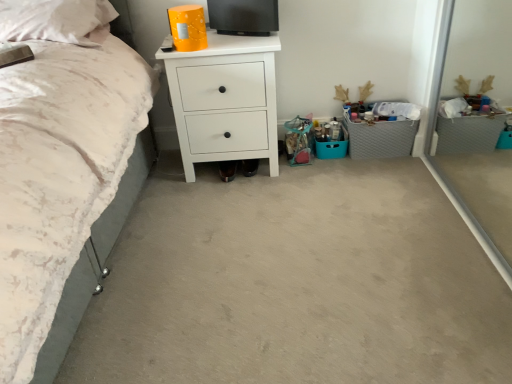
Question: Considering the relative sizes of white soft pillow at upper left and gray fabric storage at right in the image provided, is white soft pillow at upper left wider than gray fabric storage at right?

Choices:
 (A) yes
 (B) no

Answer: (A)

Question: Does white soft pillow at upper left have a greater height compared to gray fabric storage at right?

Choices:
 (A) no
 (B) yes

Answer: (A)

Question: From a real-world perspective, is white soft pillow at upper left under gray fabric storage at right?

Choices:
 (A) no
 (B) yes

Answer: (A)

Question: Considering the relative positions of white soft pillow at upper left and gray fabric storage at right in the image provided, is white soft pillow at upper left to the right of gray fabric storage at right from the viewer's perspective?

Choices:
 (A) no
 (B) yes

Answer: (A)

Question: Does white soft pillow at upper left have a lesser width compared to gray fabric storage at right?

Choices:
 (A) yes
 (B) no

Answer: (B)

Question: From the image's perspective, is white soft pillow at upper left above gray fabric storage at right?

Choices:
 (A) yes
 (B) no

Answer: (A)

Question: Is white soft pillow at upper left in front of white matte chest of drawers at center?

Choices:
 (A) yes
 (B) no

Answer: (A)

Question: Is white soft pillow at upper left behind white matte chest of drawers at center?

Choices:
 (A) yes
 (B) no

Answer: (B)

Question: Considering the relative positions of white soft pillow at upper left and white matte chest of drawers at center in the image provided, is white soft pillow at upper left to the left of white matte chest of drawers at center from the viewer's perspective?

Choices:
 (A) yes
 (B) no

Answer: (A)

Question: Considering the relative sizes of white soft pillow at upper left and white matte chest of drawers at center in the image provided, is white soft pillow at upper left shorter than white matte chest of drawers at center?

Choices:
 (A) yes
 (B) no

Answer: (A)

Question: Is white soft pillow at upper left oriented away from white matte chest of drawers at center?

Choices:
 (A) yes
 (B) no

Answer: (B)

Question: Could white matte chest of drawers at center be considered to be inside white soft pillow at upper left?

Choices:
 (A) yes
 (B) no

Answer: (B)

Question: From a real-world perspective, is gray fabric storage at right physically above white matte chest of drawers at center?

Choices:
 (A) yes
 (B) no

Answer: (B)